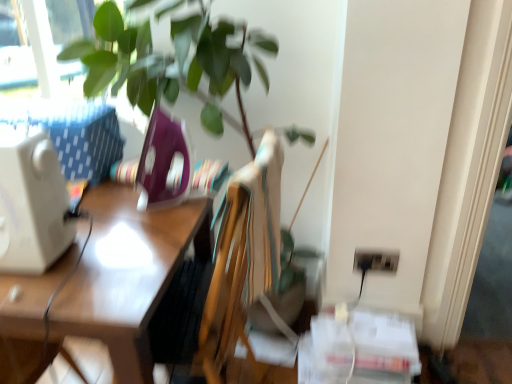
What is the approximate width of white plastic desktop computer at left?

6.68 inches.

What do you see at coordinates (127, 274) in the screenshot? The width and height of the screenshot is (512, 384). I see `wooden desk at left` at bounding box center [127, 274].

At what (x,y) coordinates should I click in order to perform the action: click on black plastic electric outlet at lower right. Please return your answer as a coordinate pair (x, y). The image size is (512, 384). Looking at the image, I should click on (375, 260).

Is black plastic electric outlet at lower right completely or partially outside of white plastic desktop computer at left?

Yes, black plastic electric outlet at lower right is not within white plastic desktop computer at left.

Which of these two, black plastic electric outlet at lower right or white plastic desktop computer at left, is bigger?

With larger size is white plastic desktop computer at left.

From the image's perspective, is black plastic electric outlet at lower right beneath white plastic desktop computer at left?

Correct, black plastic electric outlet at lower right appears lower than white plastic desktop computer at left in the image.

Looking at this image, which object is closer to the camera, black plastic electric outlet at lower right or white plastic desktop computer at left?

white plastic desktop computer at left is closer to the camera.

Who is taller, white plastic desktop computer at left or black plastic electric outlet at lower right?

Standing taller between the two is white plastic desktop computer at left.

Based on the photo, which is behind, white plastic desktop computer at left or black plastic electric outlet at lower right?

black plastic electric outlet at lower right is behind.

Would you say white plastic desktop computer at left contains black plastic electric outlet at lower right?

No.

Between white plastic desktop computer at left and black plastic electric outlet at lower right, which one has smaller width?

Thinner between the two is black plastic electric outlet at lower right.

Does black plastic electric outlet at lower right turn towards wooden desk at left?

No, black plastic electric outlet at lower right is not facing towards wooden desk at left.

Based on the photo, is wooden desk at left surrounded by black plastic electric outlet at lower right?

No, black plastic electric outlet at lower right does not contain wooden desk at left.

Is point (354, 260) behind point (124, 202)?

Yes.

Is black plastic electric outlet at lower right thinner than wooden desk at left?

Yes.

Is point (57, 173) closer or farther from the camera than point (196, 205)?

Point (57, 173) appears to be closer to the viewer than point (196, 205).

Is white plastic desktop computer at left wider than wooden desk at left?

No, white plastic desktop computer at left is not wider than wooden desk at left.

From the image's perspective, which is above, white plastic desktop computer at left or wooden desk at left?

white plastic desktop computer at left is shown above in the image.

In the image, is white plastic desktop computer at left positioned in front of or behind wooden desk at left?

In the image, white plastic desktop computer at left appears behind wooden desk at left.

Considering the points (120, 379) and (358, 263), which point is behind, point (120, 379) or point (358, 263)?

The point (358, 263) is behind.

From a real-world perspective, which object rests below the other?

wooden desk at left is physically lower.

Is wooden desk at left bigger than black plastic electric outlet at lower right?

Yes.

Is the depth of wooden desk at left greater than that of white plastic desktop computer at left?

No, it is in front of white plastic desktop computer at left.

Can you confirm if wooden desk at left is taller than white plastic desktop computer at left?

Yes.

Is point (157, 296) positioned after point (50, 244)?

Yes, it is.

Choose the correct answer: Is wooden desk at left inside white plastic desktop computer at left or outside it?

The correct answer is: outside.

Where is `desktop computer lying in front of the black plastic electric outlet at lower right`? The height and width of the screenshot is (384, 512). desktop computer lying in front of the black plastic electric outlet at lower right is located at coordinates (31, 202).

Where is `desktop computer above the black plastic electric outlet at lower right (from the image's perspective)`? Image resolution: width=512 pixels, height=384 pixels. desktop computer above the black plastic electric outlet at lower right (from the image's perspective) is located at coordinates tap(31, 202).

Based on their spatial positions, is black plastic electric outlet at lower right or wooden desk at left closer to white plastic desktop computer at left?

wooden desk at left is positioned closer to the anchor white plastic desktop computer at left.

From the image, which object appears to be nearer to wooden desk at left, black plastic electric outlet at lower right or white plastic desktop computer at left?

Answer: Based on the image, white plastic desktop computer at left appears to be nearer to wooden desk at left.

From the image, which object appears to be nearer to white plastic desktop computer at left, wooden desk at left or black plastic electric outlet at lower right?

The object closer to white plastic desktop computer at left is wooden desk at left.

Looking at the image, which one is located closer to black plastic electric outlet at lower right, white plastic desktop computer at left or wooden desk at left?

wooden desk at left lies closer to black plastic electric outlet at lower right than the other object.

Considering their positions, is wooden desk at left positioned closer to black plastic electric outlet at lower right than white plastic desktop computer at left?

Among the two, wooden desk at left is located nearer to black plastic electric outlet at lower right.

Looking at the image, which one is located further to wooden desk at left, white plastic desktop computer at left or black plastic electric outlet at lower right?

The object further to wooden desk at left is black plastic electric outlet at lower right.

Image resolution: width=512 pixels, height=384 pixels. Identify the location of desktop computer between wooden desk at left and black plastic electric outlet at lower right in the horizontal direction. (31, 202).